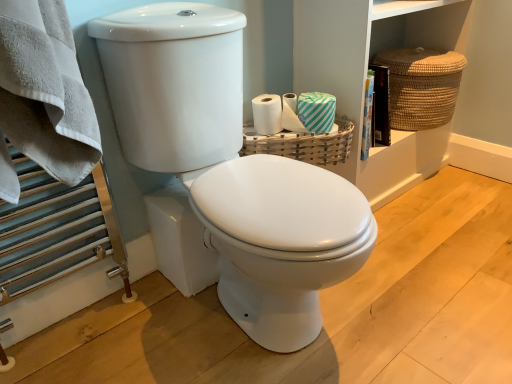
Question: Considering the positions of braided straw basket at upper right, placed as the first basket when sorted from right to left, and white glossy toilet at center, the second toilet viewed from the back, in the image, is braided straw basket at upper right, placed as the first basket when sorted from right to left, taller or shorter than white glossy toilet at center, the second toilet viewed from the back,?

Choices:
 (A) tall
 (B) short

Answer: (B)

Question: Is braided straw basket at upper right, which is the 1th basket from top to bottom, wider or thinner than white glossy toilet at center, positioned as the first toilet in front-to-back order?

Choices:
 (A) wide
 (B) thin

Answer: (B)

Question: Estimate the real-world distances between objects in this image. Which object is closer to the woven wood basket at upper right, which is the 2th basket in back-to-front order?

Choices:
 (A) teal striped tissue at upper right
 (B) brown woven basket at upper right
 (C) white glossy toilet at center, marked as the second toilet in a front-to-back arrangement
 (D) braided straw basket at upper right, arranged as the second basket when ordered from the bottom
 (E) white glossy toilet at center, positioned as the first toilet in front-to-back order

Answer: (A)

Question: Which of these objects is positioned farthest from the teal striped tissue at upper right?

Choices:
 (A) brown woven basket at upper right
 (B) white glossy toilet at center, which is the first toilet from back to front
 (C) braided straw basket at upper right, the 2th basket viewed from the front
 (D) white glossy toilet at center, the second toilet viewed from the back
 (E) woven wood basket at upper right, marked as the 1th basket in a left-to-right arrangement

Answer: (B)